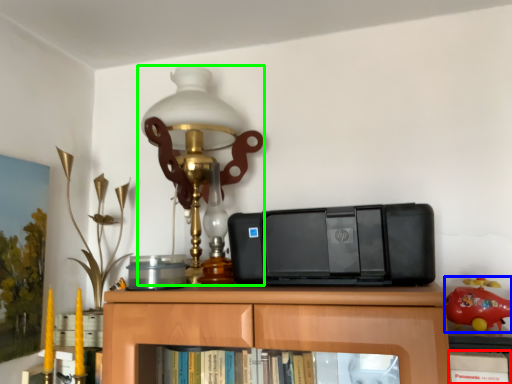
Question: Estimate the real-world distances between objects in this image. Which object is farther from book (highlighted by a red box), toy (highlighted by a blue box) or lamp (highlighted by a green box)?

Choices:
 (A) toy
 (B) lamp

Answer: (B)